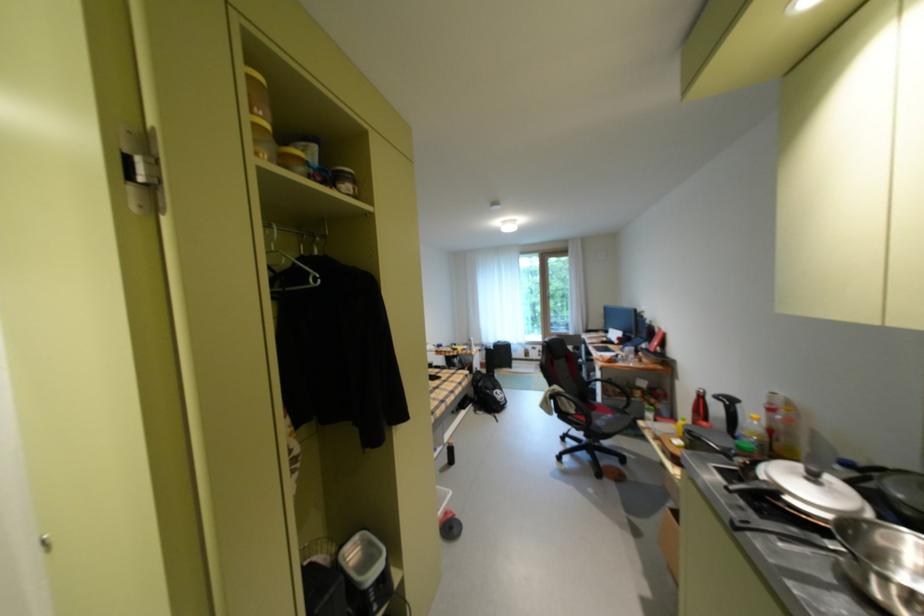
What do you see at coordinates (608, 415) in the screenshot?
I see `the chair sitting surface` at bounding box center [608, 415].